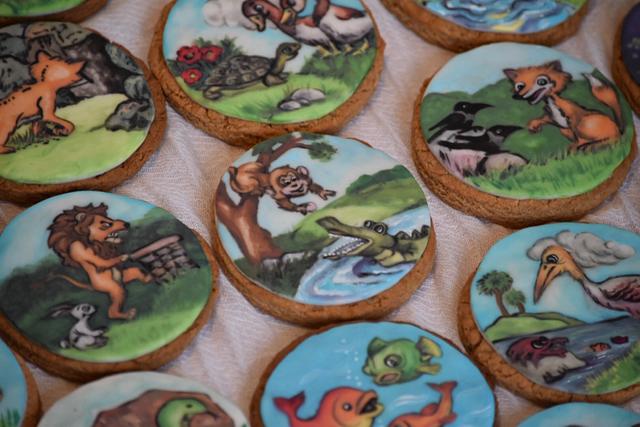
Locate an element on the screen. fabric is located at coordinates click(179, 160).